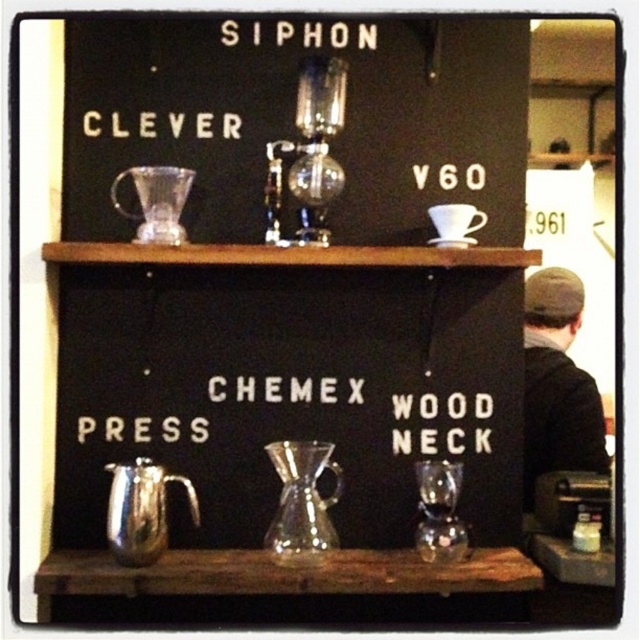
You are a barista trying to place a dark gray knit cap at right into a clear glass carafe at upper center. Will the cap fit inside the carafe?

The clear glass carafe at upper center might be wider than dark gray knit cap at right, so there is a possibility that the cap could fit inside, but it depends on the exact dimensions.

You are a barista trying to place the white plastic chemex press at center and dark gray knit cap at right on a narrow shelf. Which item should you place first to ensure both fit side by side?

The dark gray knit cap at right should be placed first since the white plastic chemex press at center is wider, allowing the narrower item to be positioned first to accommodate both.